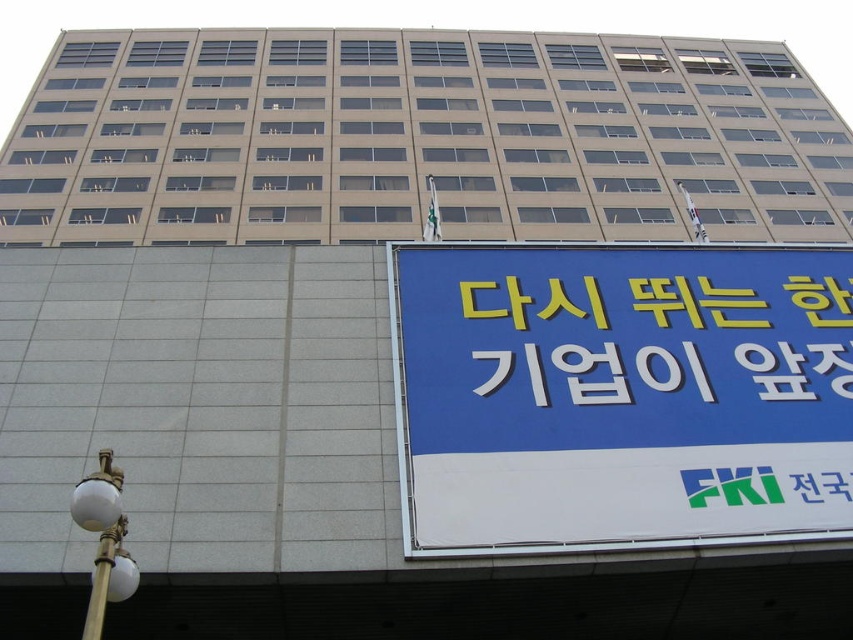
How far apart are yellow plastic sign at center and gold metallic streetlight at lower left?

yellow plastic sign at center is 18.27 meters from gold metallic streetlight at lower left.

The width and height of the screenshot is (853, 640). Describe the element at coordinates (693, 304) in the screenshot. I see `yellow plastic sign at center` at that location.

Between point (817, 294) and point (86, 490), which one is positioned behind?

The point (817, 294) is more distant.

Identify the location of yellow plastic sign at center. (693, 304).

Is blue matte signboard at lower right smaller than yellow plastic sign at center?

Actually, blue matte signboard at lower right might be larger than yellow plastic sign at center.

Is point (405, 330) more distant than point (699, 374)?

Yes, point (405, 330) is behind point (699, 374).

Where is `blue matte signboard at lower right`? The width and height of the screenshot is (853, 640). blue matte signboard at lower right is located at coordinates (624, 392).

Is point (567, 371) closer to camera compared to point (90, 604)?

No, it is behind (90, 604).

Is point (532, 289) more distant than point (111, 545)?

Yes, it is.

Image resolution: width=853 pixels, height=640 pixels. What are the coordinates of `blue matte signboard at lower right` in the screenshot? It's located at (624, 392).